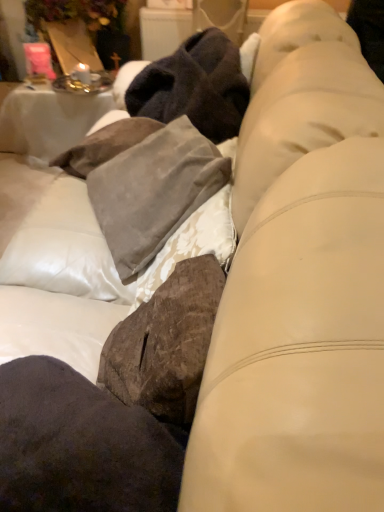
You are a GUI agent. You are given a task and a screenshot of the screen. Output one action in this format:
    pyautogui.click(x=<x>, y=<y>)
    Task: Click on the white clothed table at upper left
    Image resolution: width=384 pixels, height=512 pixels.
    Given the screenshot: What is the action you would take?
    tap(48, 120)

Find the location of a particular element. The width and height of the screenshot is (384, 512). white clothed table at upper left is located at coordinates 48,120.

Is suede pillow at center located within dark brown suede pillow at lower left?

No, dark brown suede pillow at lower left does not contain suede pillow at center.

Looking at this image, considering the sizes of objects dark brown suede pillow at lower left and suede pillow at center in the image provided, who is smaller, dark brown suede pillow at lower left or suede pillow at center?

dark brown suede pillow at lower left.

Is point (54, 476) positioned in front of point (103, 230)?

That is True.

From a real-world perspective, which is physically below, dark brown suede pillow at lower left or suede pillow at center?

From a 3D spatial view, suede pillow at center is below.

Find the location of a particular element. table on the left of dark brown suede pillow at lower left is located at coordinates click(48, 120).

Is dark brown suede pillow at lower left positioned in front of white clothed table at upper left?

Yes, it is.

Can you see dark brown suede pillow at lower left touching white clothed table at upper left?

dark brown suede pillow at lower left and white clothed table at upper left are clearly separated.

From a real-world perspective, who is located lower, dark brown suede pillow at lower left or white clothed table at upper left?

white clothed table at upper left, from a real-world perspective.

Is suede pillow at center placed right next to dark brown suede pillow at lower left?

No, suede pillow at center is not touching dark brown suede pillow at lower left.

Considering the sizes of objects suede pillow at center and dark brown suede pillow at lower left in the image provided, who is smaller, suede pillow at center or dark brown suede pillow at lower left?

With smaller size is dark brown suede pillow at lower left.

Considering their positions, is suede pillow at center located in front of or behind dark brown suede pillow at lower left?

suede pillow at center is behind dark brown suede pillow at lower left.

From the image's perspective, is white clothed table at upper left located beneath dark brown suede pillow at lower left?

No, from the image's perspective, white clothed table at upper left is not beneath dark brown suede pillow at lower left.

Considering the relative sizes of white clothed table at upper left and dark brown suede pillow at lower left in the image provided, is white clothed table at upper left bigger than dark brown suede pillow at lower left?

Yes, white clothed table at upper left is bigger than dark brown suede pillow at lower left.

Consider the image. Is dark brown suede pillow at lower left a part of white clothed table at upper left?

No, dark brown suede pillow at lower left is not inside white clothed table at upper left.

Measure the distance between white clothed table at upper left and dark brown suede pillow at lower left.

The distance of white clothed table at upper left from dark brown suede pillow at lower left is 6.17 feet.

Is suede pillow at center bigger than white clothed table at upper left?

No, suede pillow at center is not bigger than white clothed table at upper left.

Measure the distance between suede pillow at center and white clothed table at upper left.

1.02 meters.

Would you say suede pillow at center is inside or outside white clothed table at upper left?

suede pillow at center is not enclosed by white clothed table at upper left.

Visually, is suede pillow at center positioned to the left or to the right of white clothed table at upper left?

From the image, it's evident that suede pillow at center is to the right of white clothed table at upper left.

Which of these two, white clothed table at upper left or suede pillow at center, stands taller?

With more height is white clothed table at upper left.

Which object is thinner, white clothed table at upper left or suede pillow at center?

suede pillow at center is thinner.

From a real-world perspective, is white clothed table at upper left located beneath suede pillow at center?

Yes, from a real-world perspective, white clothed table at upper left is below suede pillow at center.

Is white clothed table at upper left at the right side of suede pillow at center?

Incorrect, white clothed table at upper left is not on the right side of suede pillow at center.

The width and height of the screenshot is (384, 512). I want to click on clothing behind the dark brown suede pillow at lower left, so 145,183.

You are a GUI agent. You are given a task and a screenshot of the screen. Output one action in this format:
    pyautogui.click(x=<x>, y=<y>)
    Task: Click on the table lying on the left of dark brown suede pillow at lower left
    
    Given the screenshot: What is the action you would take?
    pyautogui.click(x=48, y=120)

Considering their positions, is white clothed table at upper left positioned closer to dark brown suede pillow at lower left than suede pillow at center?

suede pillow at center lies closer to dark brown suede pillow at lower left than the other object.

Estimate the real-world distances between objects in this image. Which object is further from dark brown suede pillow at lower left, suede pillow at center or white clothed table at upper left?

white clothed table at upper left is further to dark brown suede pillow at lower left.

Which object lies nearer to the anchor point suede pillow at center, dark brown suede pillow at lower left or white clothed table at upper left?

dark brown suede pillow at lower left is closer to suede pillow at center.

Looking at the image, which one is located further to white clothed table at upper left, suede pillow at center or dark brown suede pillow at lower left?

The object further to white clothed table at upper left is dark brown suede pillow at lower left.

Looking at the image, which one is located closer to suede pillow at center, white clothed table at upper left or dark brown suede pillow at lower left?

The object closer to suede pillow at center is dark brown suede pillow at lower left.

Based on the photo, which object lies nearer to the anchor point white clothed table at upper left, dark brown suede pillow at lower left or suede pillow at center?

Among the two, suede pillow at center is located nearer to white clothed table at upper left.

You are a GUI agent. You are given a task and a screenshot of the screen. Output one action in this format:
    pyautogui.click(x=<x>, y=<y>)
    Task: Click on the clothing positioned between dark brown suede pillow at lower left and white clothed table at upper left from near to far
    
    Given the screenshot: What is the action you would take?
    pyautogui.click(x=145, y=183)